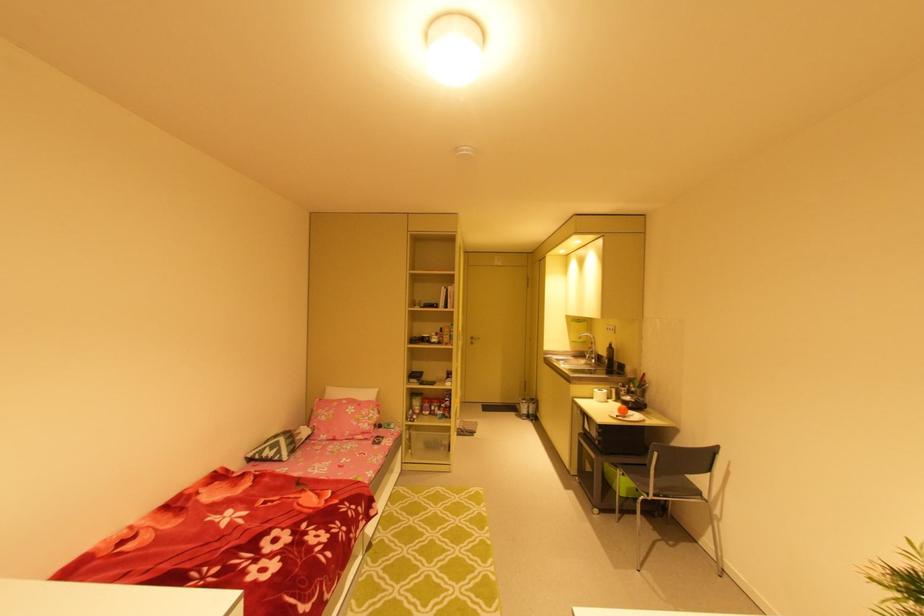
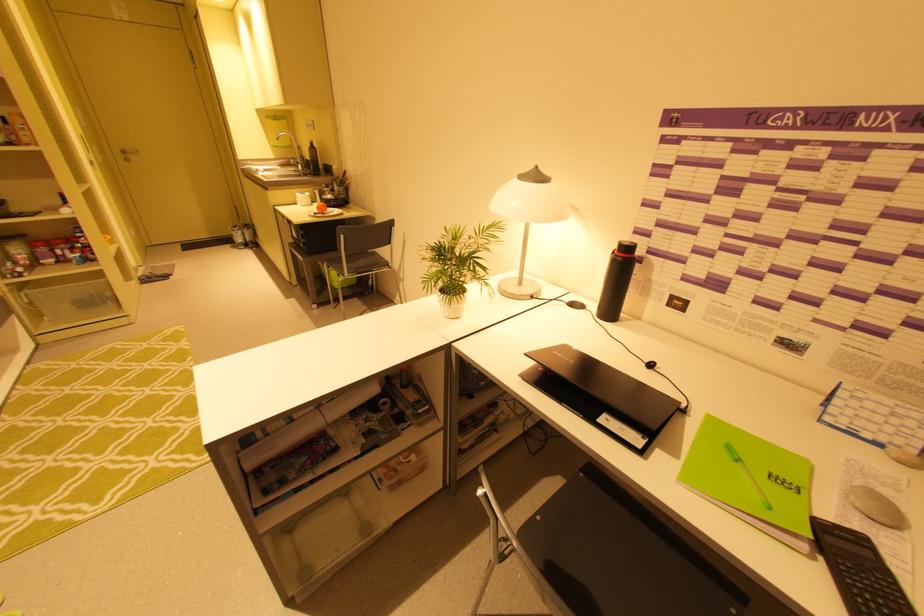
Locate, in the second image, the point that corresponds to the point at 585,355 in the first image.

(293, 164)